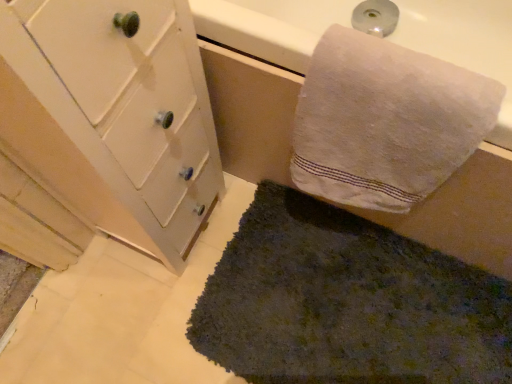
Identify the location of blank space situated above white cotton towel at upper right (from a real-world perspective). (414, 75).